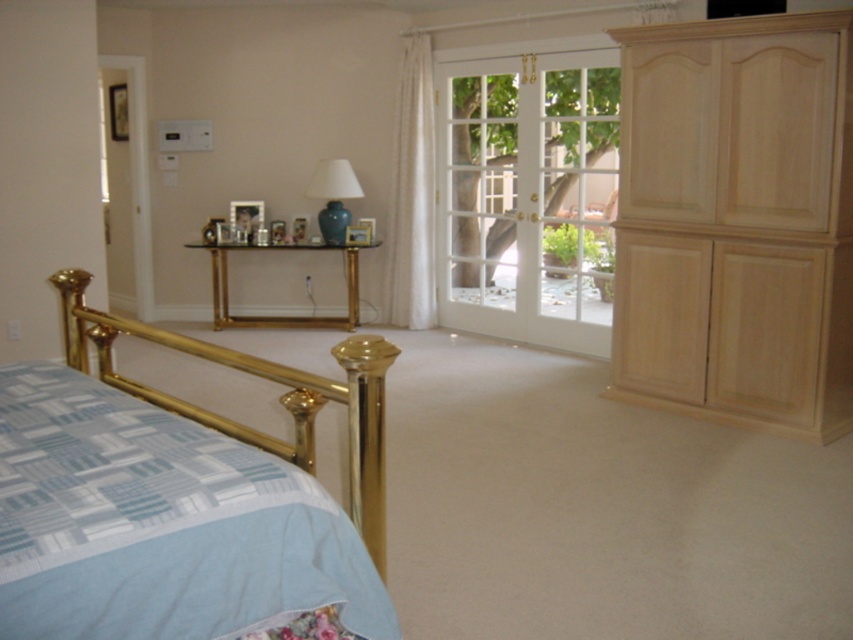
Between point (398, 129) and point (149, 225), which one is positioned in front?

Point (398, 129) is in front.

Between point (422, 298) and point (132, 266), which one is positioned in front?

Positioned in front is point (422, 298).

Where is `white sheer curtain at center`? white sheer curtain at center is located at coordinates (410, 192).

Who is higher up, light wood dresser at right or white glass screen door at upper left?

Positioned higher is white glass screen door at upper left.

Can you confirm if light wood dresser at right is smaller than white glass screen door at upper left?

No.

Based on the photo, measure the distance between point (688, 156) and camera.

They are 4.35 meters apart.

The image size is (853, 640). Identify the location of light wood dresser at right. (737, 221).

Does gold polished metal bed at lower left have a lesser height compared to white sheer curtain at center?

Yes.

Who is positioned more to the right, gold polished metal bed at lower left or white sheer curtain at center?

Positioned to the right is white sheer curtain at center.

At what (x,y) coordinates should I click in order to perform the action: click on gold polished metal bed at lower left. Please return your answer as a coordinate pair (x, y). Image resolution: width=853 pixels, height=640 pixels. Looking at the image, I should click on (183, 500).